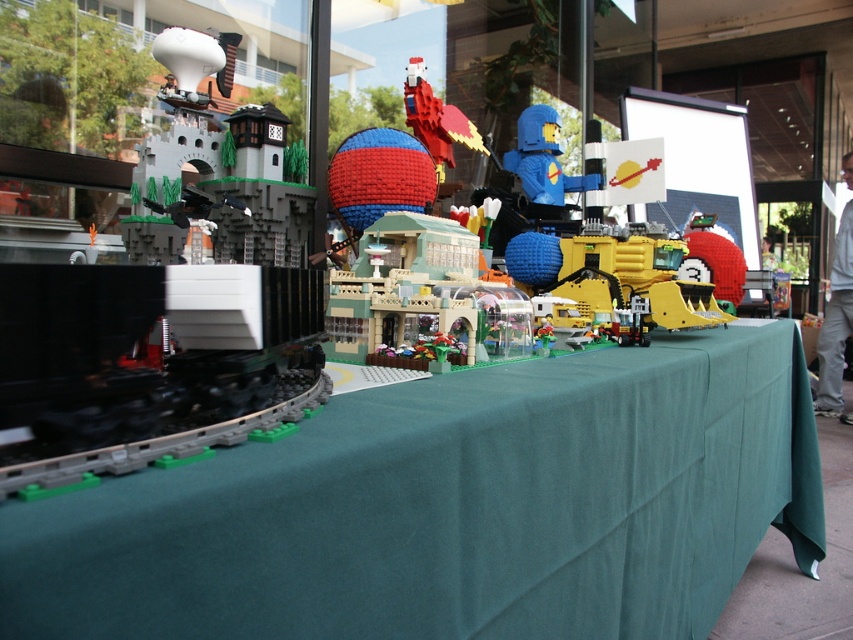
Based on the photo, you are a visitor at the LEGO exhibition and want to take a photo of the blue matte figure at center and the green fabric table at center. Which object should you focus on first if you want to capture both in the same frame without moving your camera?

The blue matte figure at center is on the left side of the green fabric table at center, so you should focus on the blue matte figure at center first to include both in the frame.